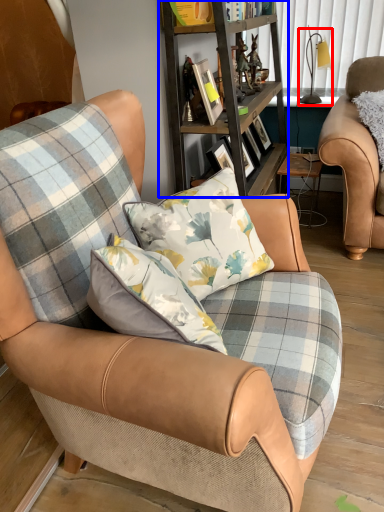
Question: Which point is closer to the camera, lamp (highlighted by a red box) or shelf (highlighted by a blue box)?

Choices:
 (A) lamp
 (B) shelf

Answer: (B)